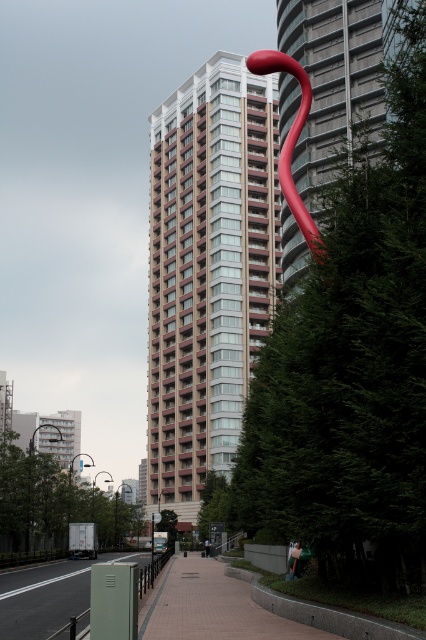
You are standing at the point marked as point (210, 608) in the urban scene. What type of surface are you currently standing on?

The point (210, 608) is on tiled pavement at center, so you are standing on tiled pavement.

You are a delivery person approaching the building and need to park your vehicle. You see the tiled pavement at center and the green matte pavement at lower left. Which pavement area is higher in elevation?

The tiled pavement at center is located above the green matte pavement at lower left, so it has a higher elevation.